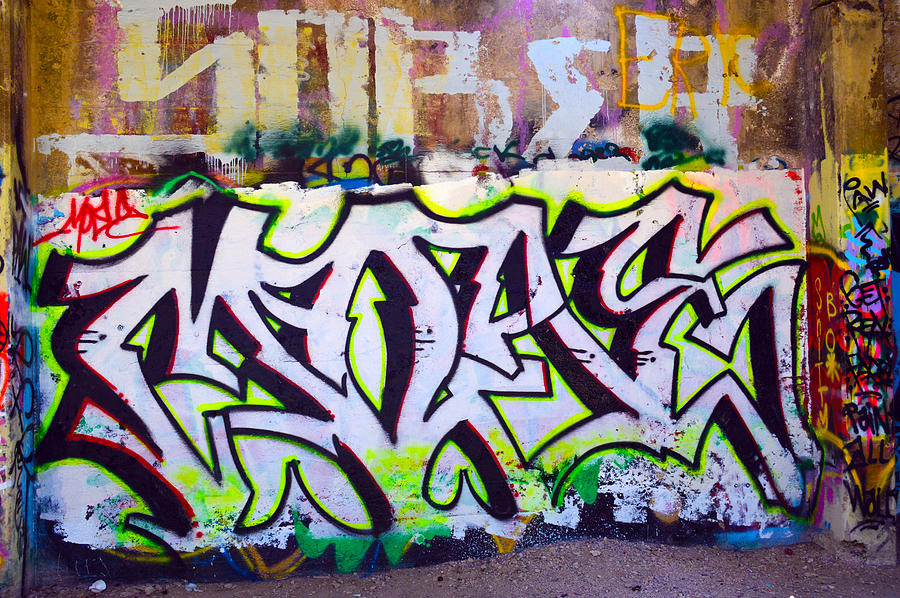
This screenshot has width=900, height=598. Find the location of `darker green paint`. darker green paint is located at coordinates (583, 489).